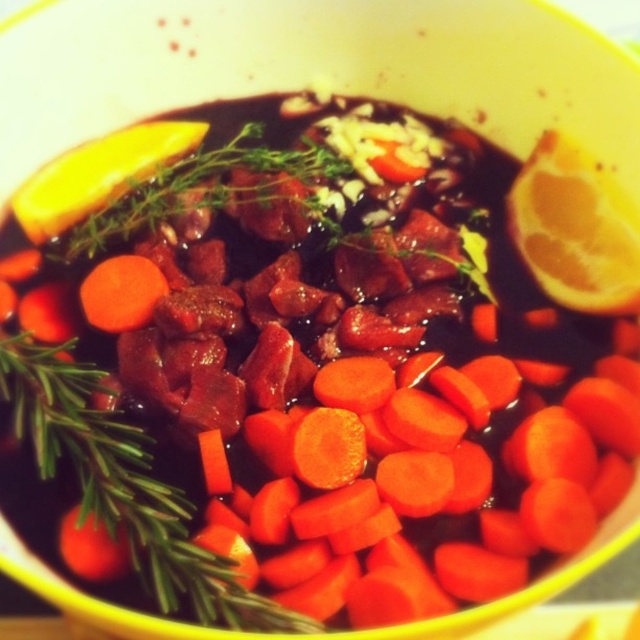
Who is positioned more to the right, bright orange carrot at center or orange smooth carrot at center?

Positioned to the right is bright orange carrot at center.

Is point (445, 476) closer to viewer compared to point (122, 317)?

Yes, point (445, 476) is in front of point (122, 317).

Find the location of a particular element. The image size is (640, 640). bright orange carrot at center is located at coordinates (419, 499).

Is matte yellow lemon at upper right bigger than orange smooth carrot at center?

Indeed, matte yellow lemon at upper right has a larger size compared to orange smooth carrot at center.

Can you confirm if matte yellow lemon at upper right is positioned above orange smooth carrot at center?

Yes, matte yellow lemon at upper right is above orange smooth carrot at center.

This screenshot has height=640, width=640. I want to click on matte yellow lemon at upper right, so click(576, 228).

Is bright orange carrot at center smaller than matte yellow lemon at upper right?

No.

Does point (352, 593) lie in front of point (621, 221)?

Yes, it is in front of point (621, 221).

You are a GUI agent. You are given a task and a screenshot of the screen. Output one action in this format:
    pyautogui.click(x=<x>, y=<y>)
    Task: Click on the bright orange carrot at center
    This screenshot has height=640, width=640.
    Given the screenshot: What is the action you would take?
    pyautogui.click(x=419, y=499)